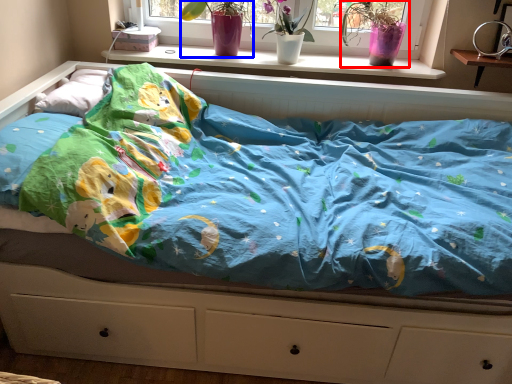
Question: Which object appears closest to the camera in this image, floral arrangement (highlighted by a red box) or floral arrangement (highlighted by a blue box)?

Choices:
 (A) floral arrangement
 (B) floral arrangement

Answer: (B)